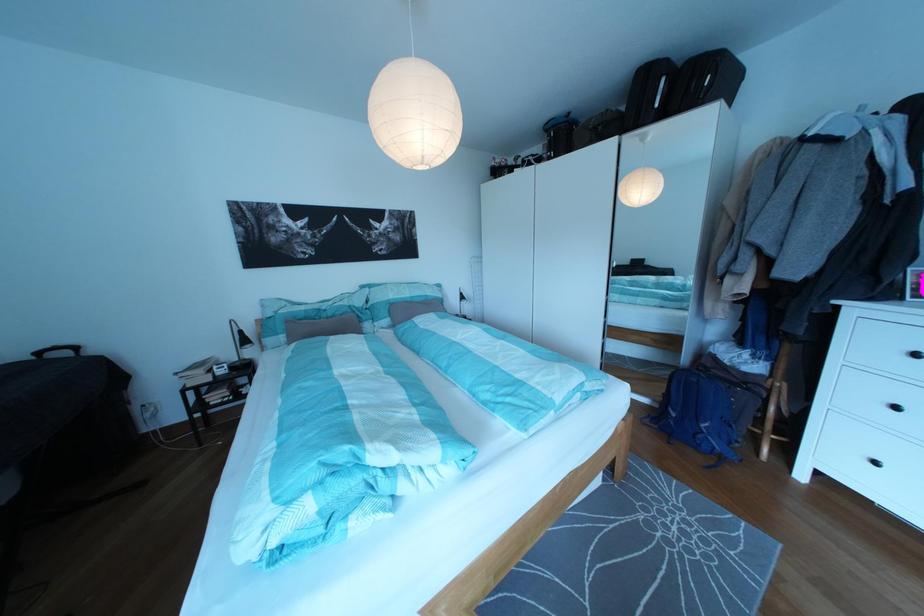
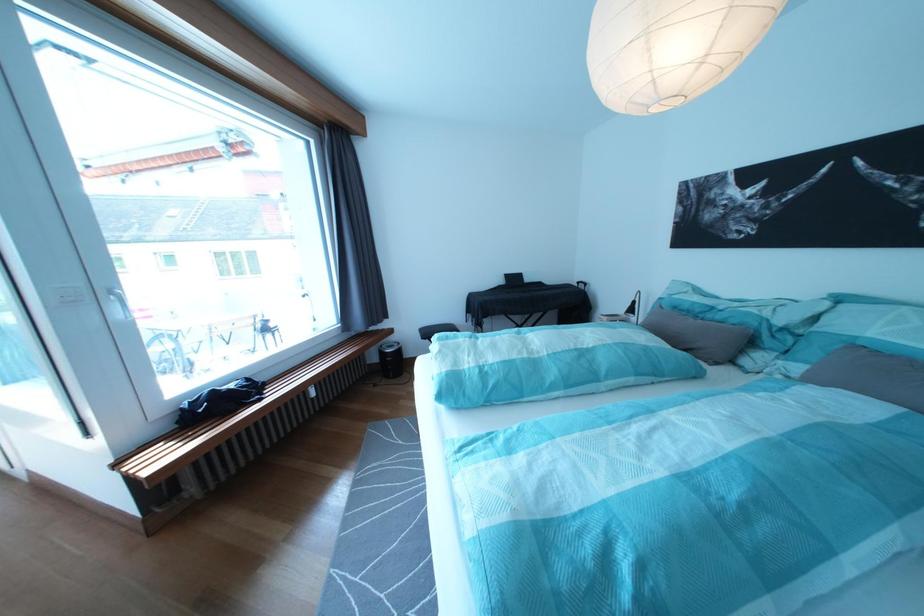
Find the pixel in the second image that matches (x=381, y=294) in the first image.

(841, 309)